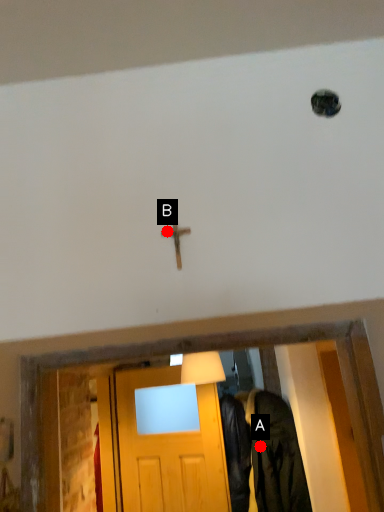
Question: Two points are circled on the image, labeled by A and B beside each circle. Among these points, which one is farthest from the camera?

Choices:
 (A) A is further
 (B) B is further

Answer: (A)